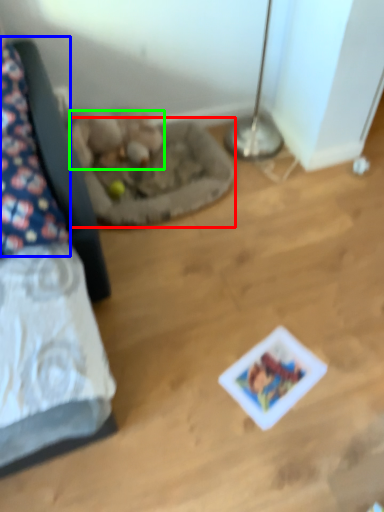
Question: Estimate the real-world distances between objects in this image. Which object is farther from cat bed (highlighted by a red box), pillow (highlighted by a blue box) or animal (highlighted by a green box)?

Choices:
 (A) pillow
 (B) animal

Answer: (A)